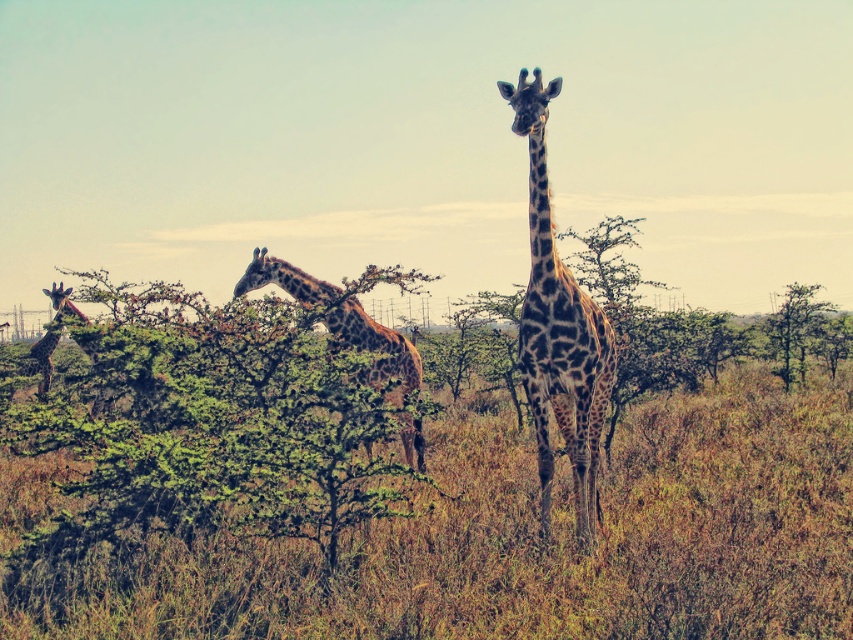
Question: Which object appears farthest from the camera in this image?

Choices:
 (A) spotted fur giraffe at center
 (B) green leafy tree at upper right

Answer: (B)

Question: Is brown dry grass at center further to the viewer compared to spotted brown giraffe at center?

Choices:
 (A) no
 (B) yes

Answer: (A)

Question: Is green leafy tree at upper right closer to camera compared to spotted fur giraffe at left?

Choices:
 (A) no
 (B) yes

Answer: (A)

Question: Which of these objects is positioned closest to the spotted fur giraffe at center?

Choices:
 (A) spotted brown giraffe at center
 (B) spotted fur giraffe at left
 (C) brown dry grass at center
 (D) green leafy bush at center

Answer: (A)

Question: Does brown dry grass at center appear under green leafy bush at center?

Choices:
 (A) yes
 (B) no

Answer: (A)

Question: Estimate the real-world distances between objects in this image. Which object is farther from the spotted brown giraffe at center?

Choices:
 (A) brown dry grass at center
 (B) spotted fur giraffe at left
 (C) spotted fur giraffe at center
 (D) green leafy bush at center

Answer: (B)